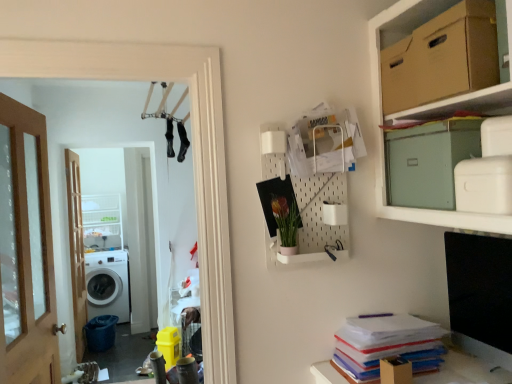
Question: Is point (96, 216) closer or farther from the camera than point (150, 66)?

Choices:
 (A) closer
 (B) farther

Answer: (B)

Question: Do you think white plastic cabinet at left is within white glossy laundry machine at left, or outside of it?

Choices:
 (A) outside
 (B) inside

Answer: (A)

Question: Based on their relative distances, which object is farther from the brown wooden door at left, the 1th door when ordered from back to front?

Choices:
 (A) matte green cardboard box at upper right, which is counted as the 1th cardboard box, starting from the bottom
 (B) white glossy washing machine at left
 (C) wooden door at left, the 2th door when ordered from left to right
 (D) white glossy laundry machine at left
 (E) green matte plant at upper center

Answer: (A)

Question: Estimate the real-world distances between objects in this image. Which object is farther from the white glossy washing machine at left?

Choices:
 (A) green matte plant at upper center
 (B) wooden door at left, the 1th door viewed from the right
 (C) brown wooden door at left, placed as the second door when sorted from right to left
 (D) white plastic cabinet at left
 (E) matte green cardboard box at upper right, which is counted as the 1th cardboard box, starting from the bottom

Answer: (E)